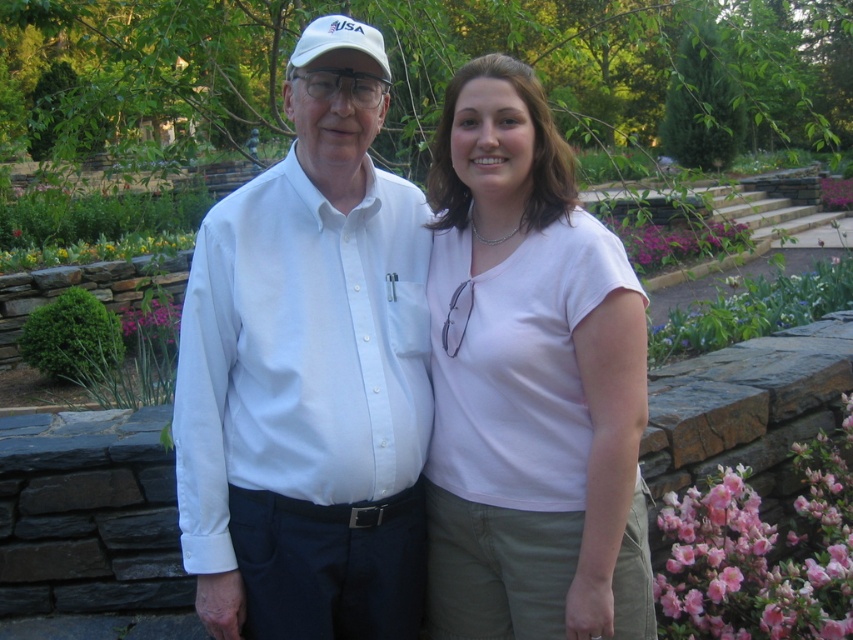
Question: Does white smooth shirt at left come in front of pink petal at upper center?

Choices:
 (A) no
 (B) yes

Answer: (B)

Question: Does pink matte flowers at lower right have a greater width compared to pink matte flower at center?

Choices:
 (A) no
 (B) yes

Answer: (A)

Question: Can you confirm if pink matte flowers at lower right is positioned below pink petal at upper center?

Choices:
 (A) yes
 (B) no

Answer: (A)

Question: Which object is closer to the camera taking this photo?

Choices:
 (A) pink matte flowers at lower right
 (B) pink matte flower at center
 (C) white fabric baseball cap at upper center

Answer: (C)

Question: Which of the following is the closest to the observer?

Choices:
 (A) pink matte flowers at lower right
 (B) white fabric baseball cap at upper center

Answer: (B)

Question: Which object is farther from the camera taking this photo?

Choices:
 (A) pink petal at upper center
 (B) pink matte flowers at lower right
 (C) white smooth shirt at left

Answer: (A)